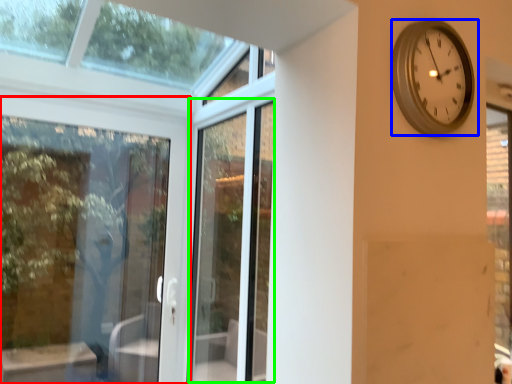
Question: Based on their relative distances, which object is nearer to door (highlighted by a red box)? Choose from wall clock (highlighted by a blue box) and screen door (highlighted by a green box).

Choices:
 (A) wall clock
 (B) screen door

Answer: (B)